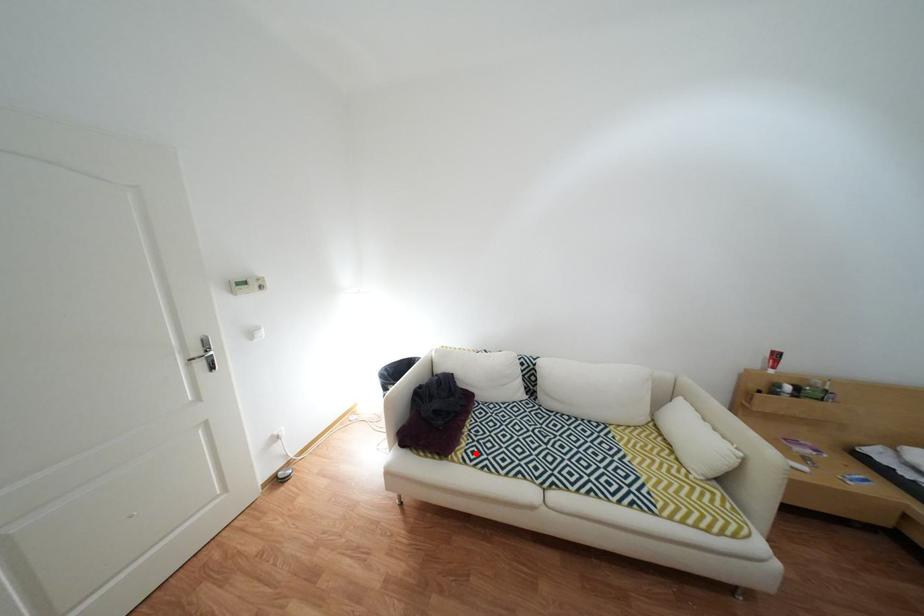
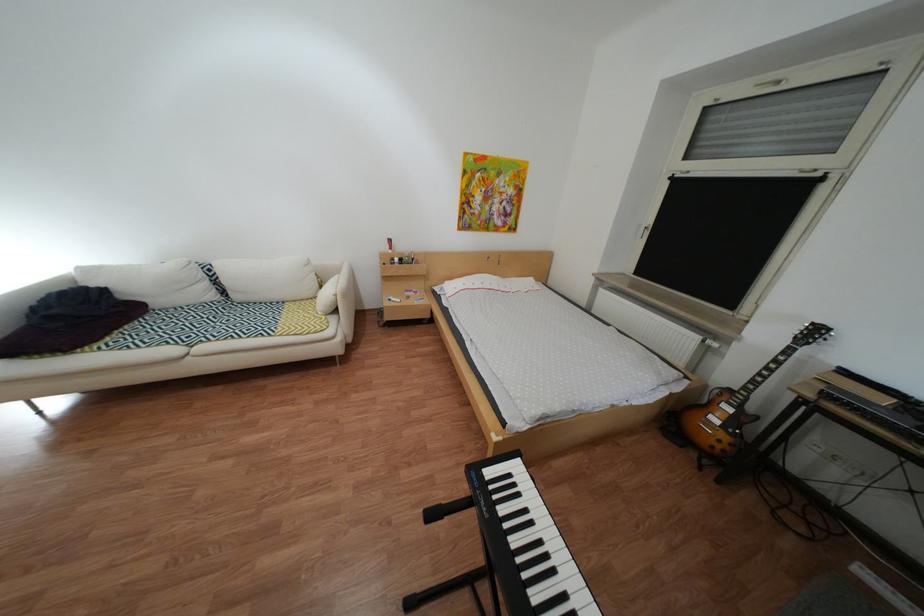
In the second image, find the point that corresponds to the highlighted location in the first image.

(113, 346)